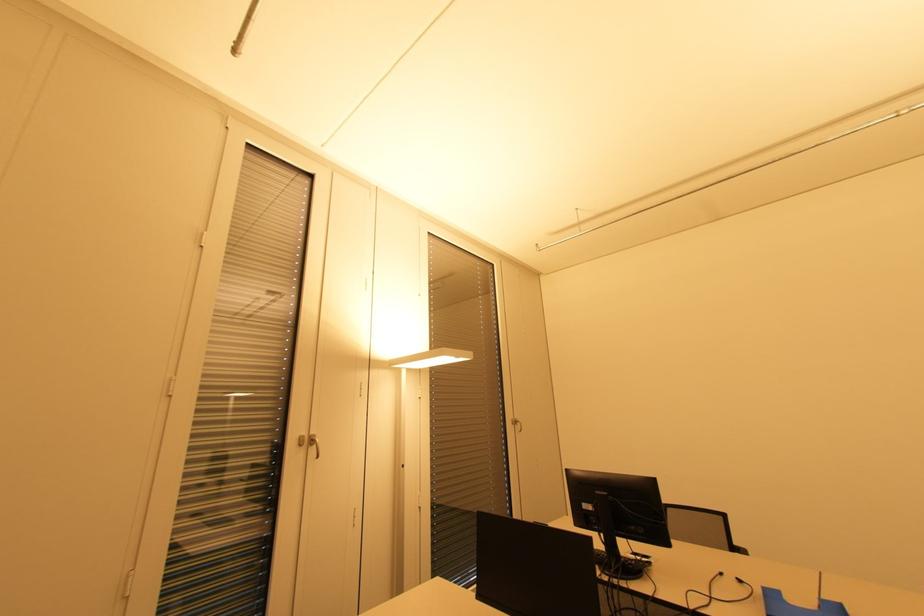
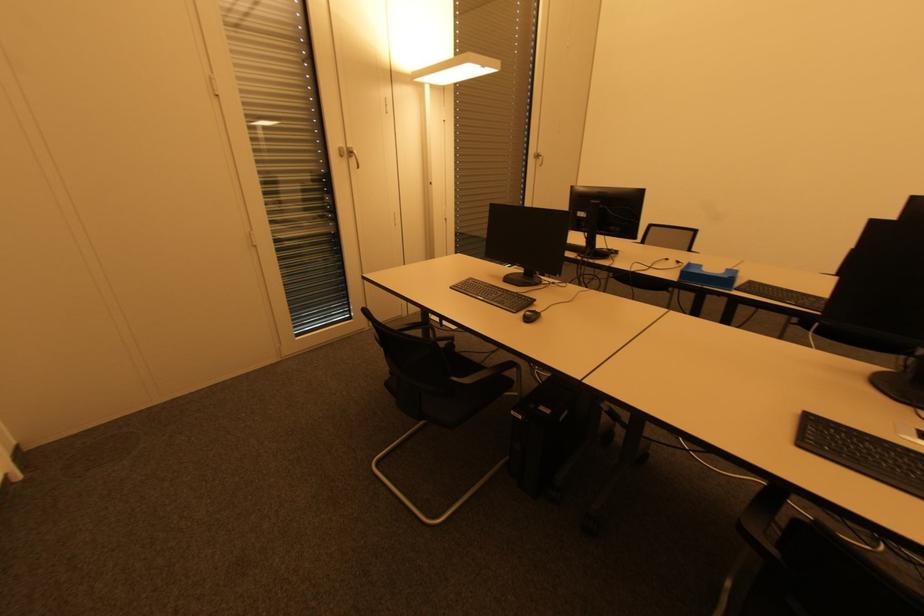
Question: The first image is from the beginning of the video and the second image is from the end. How did the camera likely rotate when shooting the video?

Choices:
 (A) Left
 (B) Right
 (C) Up
 (D) Down

Answer: (D)